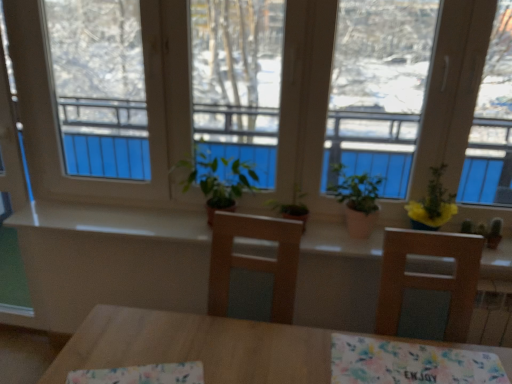
Question: Does floral fabric tablecloth at lower center, positioned as the 2th tablecloth in left-to-right order, have a larger size compared to green matte plant at center, the third houseplant viewed from the right?

Choices:
 (A) no
 (B) yes

Answer: (A)

Question: Considering the relative sizes of floral fabric tablecloth at lower center, which is the 1th tablecloth in right-to-left order, and green matte plant at center, the third houseplant viewed from the right, in the image provided, is floral fabric tablecloth at lower center, which is the 1th tablecloth in right-to-left order, thinner than green matte plant at center, the third houseplant viewed from the right,?

Choices:
 (A) yes
 (B) no

Answer: (B)

Question: Is floral fabric tablecloth at lower center, positioned as the 2th tablecloth in left-to-right order, positioned before green matte plant at center, marked as the first houseplant in a left-to-right arrangement?

Choices:
 (A) yes
 (B) no

Answer: (A)

Question: Is floral fabric tablecloth at lower center, positioned as the 2th tablecloth in left-to-right order, far away from green matte plant at center, marked as the first houseplant in a left-to-right arrangement?

Choices:
 (A) no
 (B) yes

Answer: (A)

Question: From a real-world perspective, is floral fabric tablecloth at lower center, which is the 1th tablecloth in right-to-left order, positioned over green matte plant at center, the third houseplant viewed from the right, based on gravity?

Choices:
 (A) no
 (B) yes

Answer: (A)

Question: Considering the relative sizes of floral fabric tablecloth at lower center, positioned as the 2th tablecloth in left-to-right order, and green matte plant at center, marked as the first houseplant in a left-to-right arrangement, in the image provided, is floral fabric tablecloth at lower center, positioned as the 2th tablecloth in left-to-right order, shorter than green matte plant at center, marked as the first houseplant in a left-to-right arrangement,?

Choices:
 (A) yes
 (B) no

Answer: (A)

Question: Does green matte plant at center, the 2th houseplant from the left, appear on the left side of green matte plant at center, the third houseplant viewed from the right?

Choices:
 (A) no
 (B) yes

Answer: (A)

Question: Can you confirm if green matte plant at center, the 2th houseplant from the left, is smaller than green matte plant at center, the third houseplant viewed from the right?

Choices:
 (A) yes
 (B) no

Answer: (B)

Question: Is green matte plant at center, the second houseplant viewed from the right, not close to green matte plant at center, marked as the first houseplant in a left-to-right arrangement?

Choices:
 (A) yes
 (B) no

Answer: (B)

Question: Is green matte plant at center, the 2th houseplant from the left, positioned before green matte plant at center, the third houseplant viewed from the right?

Choices:
 (A) yes
 (B) no

Answer: (A)

Question: Is green matte plant at center, marked as the first houseplant in a left-to-right arrangement, a part of green matte plant at center, the second houseplant viewed from the right?

Choices:
 (A) no
 (B) yes

Answer: (A)

Question: Does green matte plant at center, the second houseplant viewed from the right, turn towards green matte plant at center, the third houseplant viewed from the right?

Choices:
 (A) no
 (B) yes

Answer: (A)

Question: Would you say green matte plant at center, the second houseplant viewed from the right, is a long distance from floral fabric at center, which appears as the first tablecloth when viewed from the left?

Choices:
 (A) yes
 (B) no

Answer: (B)